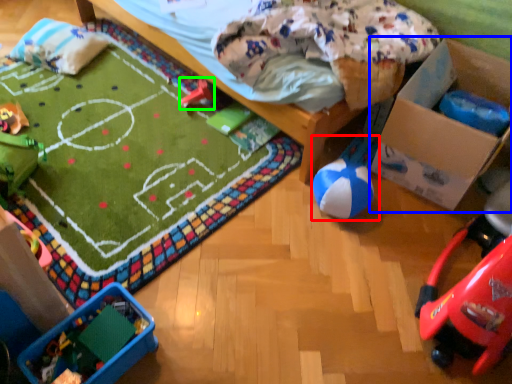
Question: Considering the real-world distances, which object is closest to toy (highlighted by a red box)? cardboard box (highlighted by a blue box) or toy (highlighted by a green box).

Choices:
 (A) cardboard box
 (B) toy

Answer: (A)